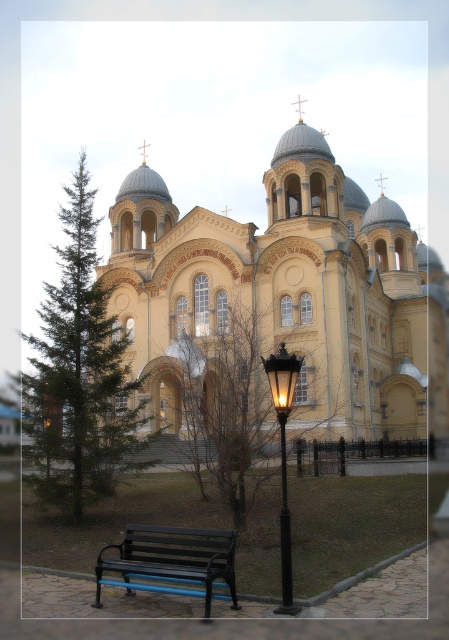
Question: Which object is farther from the camera taking this photo?

Choices:
 (A) green needle-like tree at left
 (B) black metal bench at lower left
 (C) yellow stone church at center
 (D) black glass lamp post at center

Answer: (C)

Question: Does black metal bench at lower left appear on the left side of black glass lamp post at center?

Choices:
 (A) no
 (B) yes

Answer: (B)

Question: In this image, where is yellow stone church at center located relative to black metal bench at lower left?

Choices:
 (A) above
 (B) below

Answer: (A)

Question: Among these points, which one is nearest to the camera?

Choices:
 (A) 177,560
 (B) 70,275

Answer: (A)

Question: Which point appears farthest from the camera in this image?

Choices:
 (A) (285, 390)
 (B) (44, 300)

Answer: (B)

Question: Does yellow stone church at center appear over black metal bench at lower left?

Choices:
 (A) no
 (B) yes

Answer: (B)